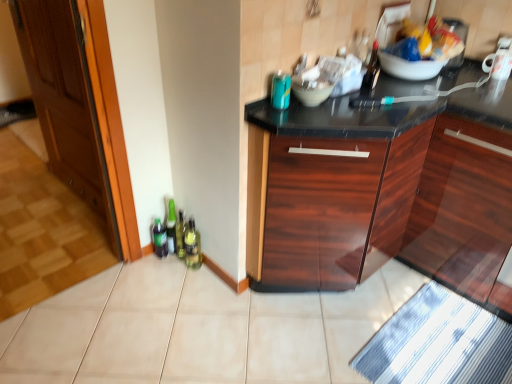
Find the location of a particular element. The image size is (512, 384). vacant area that is situated to the right of green glass bottle at lower left is located at coordinates (215, 279).